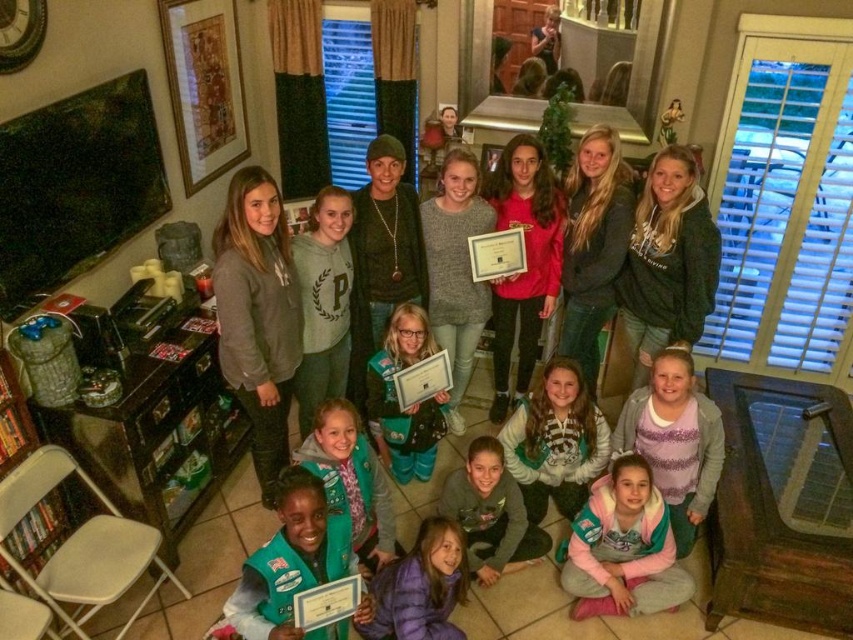
Image resolution: width=853 pixels, height=640 pixels. Describe the element at coordinates (624, 547) in the screenshot. I see `pink fleece jacket at lower center` at that location.

Does pink fleece jacket at lower center appear under green uniform at lower left?

Yes, pink fleece jacket at lower center is below green uniform at lower left.

The image size is (853, 640). What do you see at coordinates (624, 547) in the screenshot? I see `pink fleece jacket at lower center` at bounding box center [624, 547].

Locate an element on the screen. The height and width of the screenshot is (640, 853). pink fleece jacket at lower center is located at coordinates (624, 547).

Who is positioned more to the right, green uniform at lower left or green fleece vest at center?

Positioned to the right is green fleece vest at center.

Does green uniform at lower left have a smaller size compared to green fleece vest at center?

No, green uniform at lower left is not smaller than green fleece vest at center.

This screenshot has height=640, width=853. What do you see at coordinates (292, 563) in the screenshot?
I see `green uniform at lower left` at bounding box center [292, 563].

This screenshot has height=640, width=853. I want to click on green uniform at lower left, so click(x=292, y=563).

Consider the image. Is purple fleece jacket at lower center to the left of green fleece vest at center from the viewer's perspective?

In fact, purple fleece jacket at lower center is to the right of green fleece vest at center.

Who is positioned more to the left, purple fleece jacket at lower center or green fleece vest at center?

From the viewer's perspective, green fleece vest at center appears more on the left side.

Find the location of `purple fleece jacket at lower center`. purple fleece jacket at lower center is located at coordinates (675, 440).